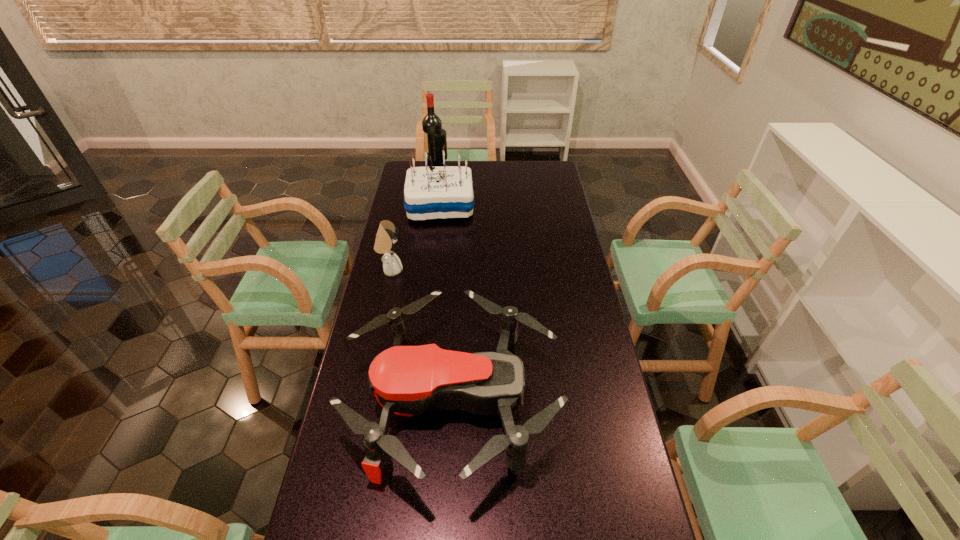
In order to click on vacant space located on the camera side of the shortest object in this screenshot , I will do `click(612, 401)`.

The height and width of the screenshot is (540, 960). What are the coordinates of `object that is positioned at the far edge` in the screenshot? It's located at (431, 124).

This screenshot has height=540, width=960. I want to click on wine bottle present at the left edge, so click(x=431, y=124).

Where is `birthday cake that is at the left edge`? This screenshot has width=960, height=540. birthday cake that is at the left edge is located at coordinates (430, 192).

This screenshot has width=960, height=540. I want to click on doll positioned at the left edge, so click(x=386, y=236).

The height and width of the screenshot is (540, 960). I want to click on drone located at the left edge, so click(406, 380).

What are the coordinates of `object located at the far left corner` in the screenshot? It's located at (431, 124).

The width and height of the screenshot is (960, 540). Find the location of `vacant space at the far edge of the desktop`. vacant space at the far edge of the desktop is located at coordinates (491, 168).

Where is `vacant space at the left edge of the desktop`? vacant space at the left edge of the desktop is located at coordinates tap(416, 273).

Where is `vacant space at the right edge of the desktop`? vacant space at the right edge of the desktop is located at coordinates (568, 393).